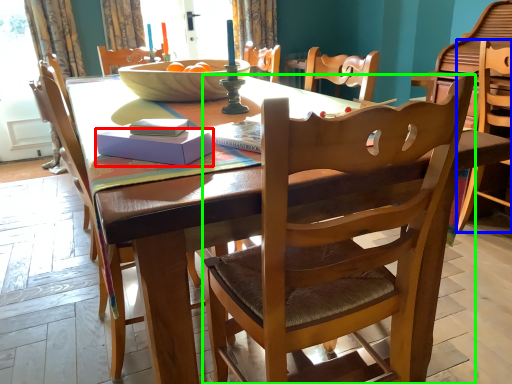
Question: Estimate the real-world distances between objects in this image. Which object is farther from box (highlighted by a red box), chair (highlighted by a blue box) or chair (highlighted by a green box)?

Choices:
 (A) chair
 (B) chair

Answer: (A)